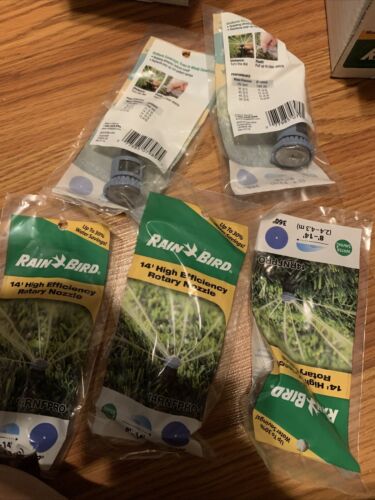
Identify the location of wood floor. This screenshot has height=500, width=375. (218, 469), (345, 136).